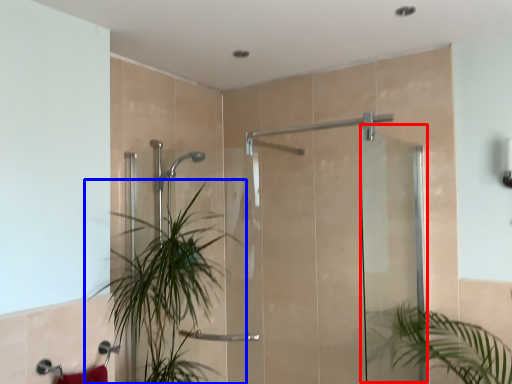
Question: Which point is closer to the camera, screen door (highlighted by a red box) or houseplant (highlighted by a blue box)?

Choices:
 (A) screen door
 (B) houseplant

Answer: (A)